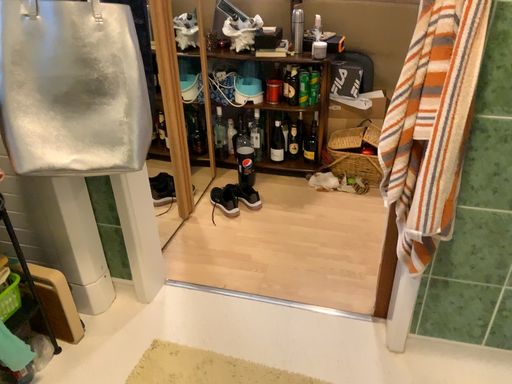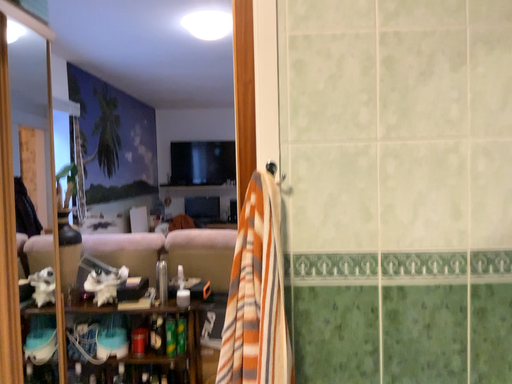
Question: How did the camera likely rotate when shooting the video?

Choices:
 (A) rotated right
 (B) rotated left

Answer: (A)